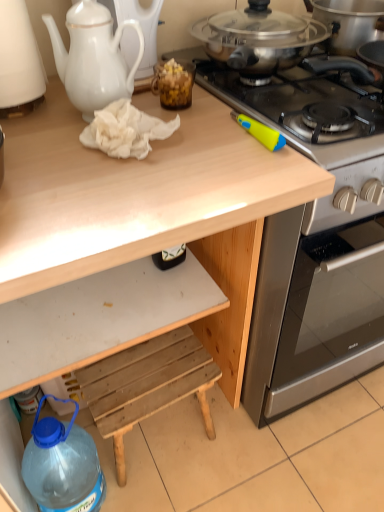
Image resolution: width=384 pixels, height=512 pixels. Find the location of `unoccupied area in front of translucent brown jar at upper center`. unoccupied area in front of translucent brown jar at upper center is located at coordinates (189, 147).